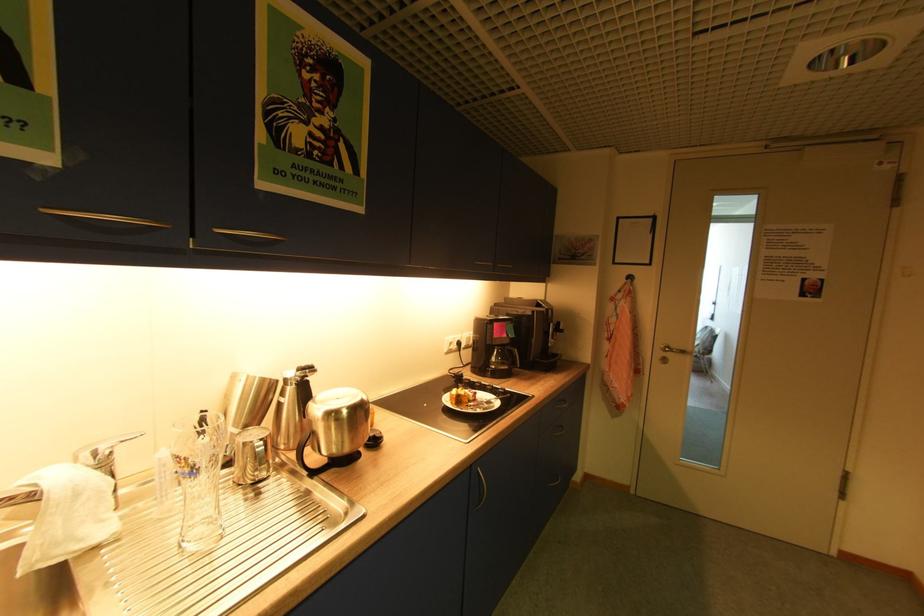
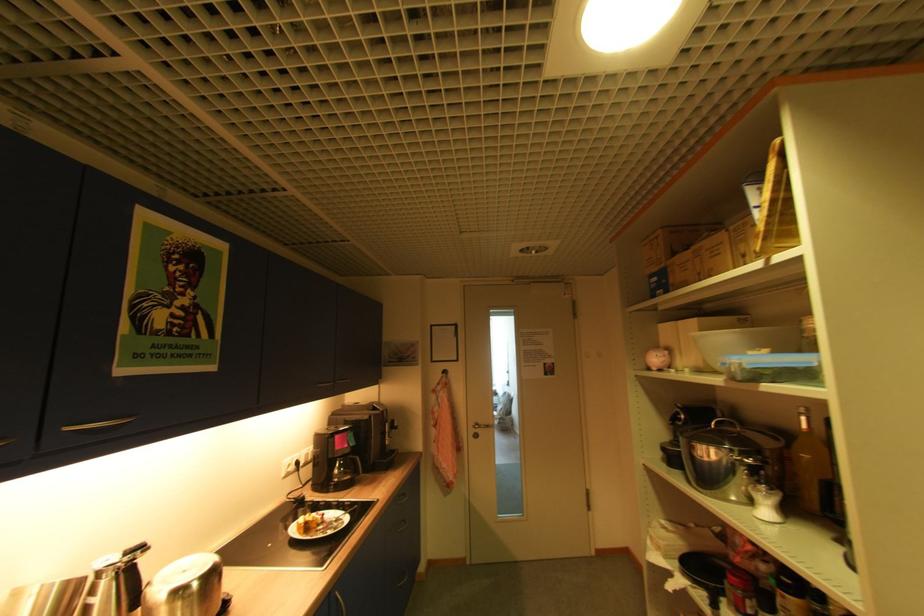
Where in the second image is the point corresponding to (555,397) from the first image?

(398, 495)